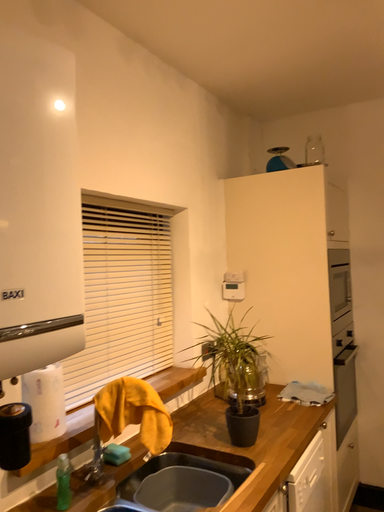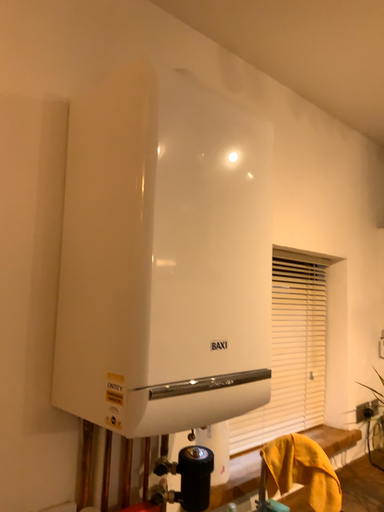
Question: Which way did the camera rotate in the video?

Choices:
 (A) rotated left
 (B) rotated right

Answer: (A)